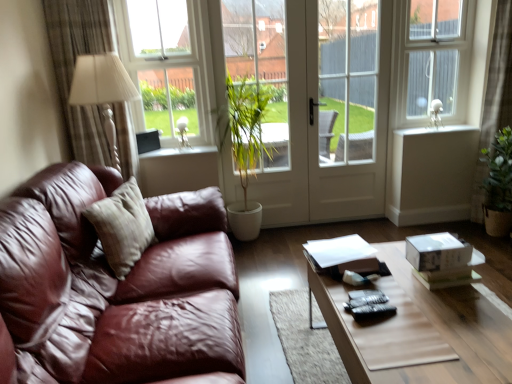
Question: From their relative heights in the image, would you say white plastic window frame at upper right is taller or shorter than white glossy screen door at center, marked as the second screen door in a right-to-left arrangement?

Choices:
 (A) short
 (B) tall

Answer: (A)

Question: Is point (421, 107) positioned closer to the camera than point (295, 119)?

Choices:
 (A) closer
 (B) farther

Answer: (B)

Question: Estimate the real-world distances between objects in this image. Which object is closer to the white smooth window sill at upper right, the second window sill positioned from the left?

Choices:
 (A) white glossy window sill at upper center, the 1th window sill positioned from the bottom
 (B) wooden coffee table at center
 (C) beige fabric pillow at left
 (D) silky beige curtain at right, marked as the 1th curtain in a right-to-left arrangement
 (E) green leafy plant at center

Answer: (D)

Question: Which object is positioned closest to the white glossy window sill at upper center, acting as the 2th window sill starting from the top?

Choices:
 (A) wooden coffee table at center
 (B) silky beige curtain at right, which is the second curtain in left-to-right order
 (C) white glossy screen door at center, marked as the second screen door in a right-to-left arrangement
 (D) clear glass window at upper left
 (E) white plastic window frame at upper right

Answer: (D)